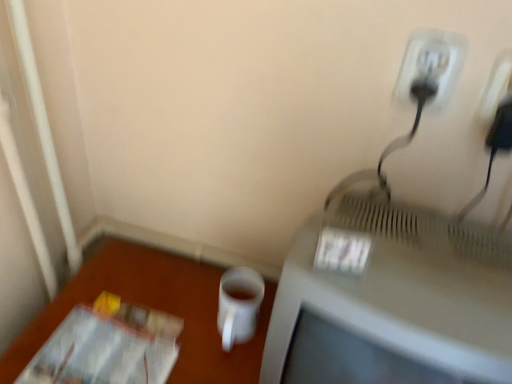
Find the location of a particular element. empty space that is ontop of matte gray television at right (from a real-world perspective) is located at coordinates (426, 286).